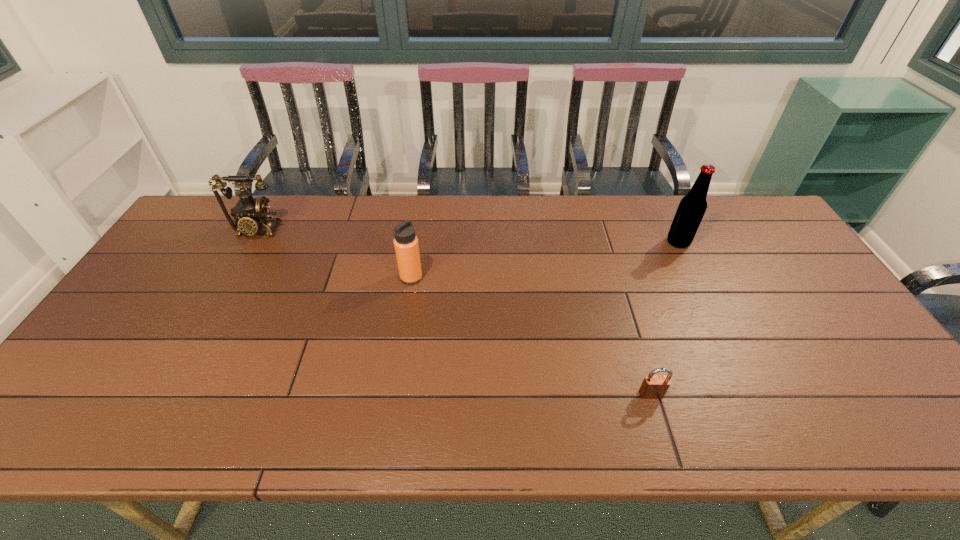
Find the location of a particular element. vacant point located between the beer bottle and the nearest object is located at coordinates (664, 319).

Identify which object is the closest to the telephone. Please provide its 2D coordinates. Your answer should be formatted as a tuple, i.e. [(x, y)], where the tuple contains the x and y coordinates of a point satisfying the conditions above.

[(406, 245)]

Point out which object is positioned as the nearest to the padlock. Please provide its 2D coordinates. Your answer should be formatted as a tuple, i.e. [(x, y)], where the tuple contains the x and y coordinates of a point satisfying the conditions above.

[(692, 207)]

Where is `vacant space that satisfies the following two spatial constraints: 1. on the rotary dial of the beer bottle; 2. on the left side of the leftmost object`? This screenshot has width=960, height=540. vacant space that satisfies the following two spatial constraints: 1. on the rotary dial of the beer bottle; 2. on the left side of the leftmost object is located at coordinates (251, 242).

Where is `vacant space that satisfies the following two spatial constraints: 1. on the rotary dial of the thermos bottle; 2. on the left side of the leftmost object`? This screenshot has width=960, height=540. vacant space that satisfies the following two spatial constraints: 1. on the rotary dial of the thermos bottle; 2. on the left side of the leftmost object is located at coordinates (230, 278).

You are a GUI agent. You are given a task and a screenshot of the screen. Output one action in this format:
    pyautogui.click(x=<x>, y=<y>)
    Task: Click on the free space that satisfies the following two spatial constraints: 1. on the rotary dial of the thermos bottle; 2. on the right side of the telephone
    The width and height of the screenshot is (960, 540).
    Given the screenshot: What is the action you would take?
    pyautogui.click(x=230, y=278)

Locate an element on the screen. vacant space that satisfies the following two spatial constraints: 1. on the back side of the tallest object; 2. on the left side of the thermos bottle is located at coordinates (417, 242).